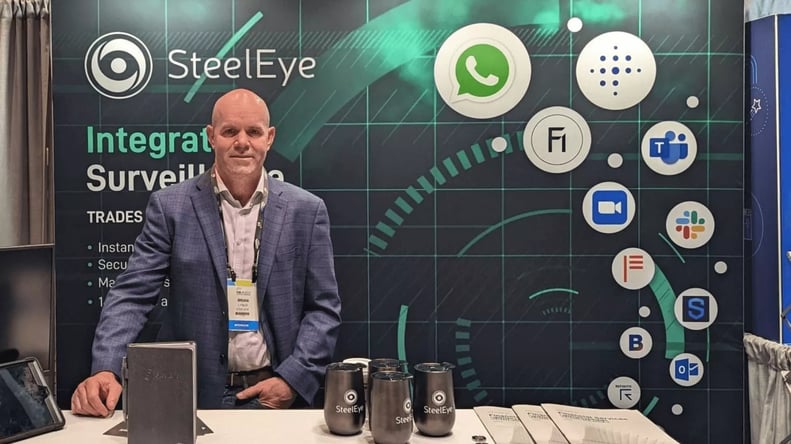
You are a GUI agent. You are given a task and a screenshot of the screen. Output one action in this format:
    pyautogui.click(x=<x>, y=<y>)
    Task: Click on the booklets
    
    Given the screenshot: What is the action you would take?
    pyautogui.click(x=583, y=427), pyautogui.click(x=550, y=427), pyautogui.click(x=508, y=427)